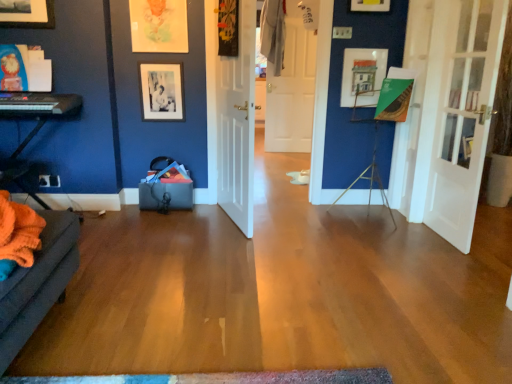
What are the coordinates of `white glass door at right, marked as the third door in a back-to-front arrangement` in the screenshot? It's located at (463, 115).

What do you see at coordinates (362, 76) in the screenshot?
I see `matte wooden picture frame at upper center, marked as the first picture frame in a right-to-left arrangement` at bounding box center [362, 76].

Measure the distance between point (148,81) and camera.

They are 3.19 meters apart.

I want to click on orange fabric couch at left, so pyautogui.click(x=34, y=127).

I want to click on matte paper picture frame at upper center, which is counted as the second picture frame, starting from the left, so click(x=159, y=26).

Can we say black matte picture frame at upper center, which is counted as the third picture frame, starting from the right, lies outside white matte door at center, the second door when ordered from right to left?

Yes, black matte picture frame at upper center, which is counted as the third picture frame, starting from the right, is not within white matte door at center, the second door when ordered from right to left.

Between black matte picture frame at upper center, which is counted as the third picture frame, starting from the right, and white matte door at center, acting as the 2th door starting from the left, which one appears on the right side from the viewer's perspective?

From the viewer's perspective, white matte door at center, acting as the 2th door starting from the left, appears more on the right side.

Would you consider black matte picture frame at upper center, marked as the first picture frame in a left-to-right arrangement, to be distant from white matte door at center, the second door when ordered from right to left?

Yes, black matte picture frame at upper center, marked as the first picture frame in a left-to-right arrangement, and white matte door at center, the second door when ordered from right to left, are located far from each other.

How many degrees apart are the facing directions of black matte picture frame at upper center, which is counted as the third picture frame, starting from the right, and white matte door at center, acting as the 2th door starting from the left?

The facing directions of black matte picture frame at upper center, which is counted as the third picture frame, starting from the right, and white matte door at center, acting as the 2th door starting from the left, are 8.02 degrees apart.

Relative to black matte picture frame at upper center, which is counted as the third picture frame, starting from the right, is black matte keyboard at left in front or behind?

black matte keyboard at left is in front of black matte picture frame at upper center, which is counted as the third picture frame, starting from the right.

Are black matte keyboard at left and black matte picture frame at upper center, which is counted as the third picture frame, starting from the right, making contact?

black matte keyboard at left is not next to black matte picture frame at upper center, which is counted as the third picture frame, starting from the right, and they're not touching.

The height and width of the screenshot is (384, 512). Find the location of `piano that appears in front of the black matte picture frame at upper center, marked as the first picture frame in a left-to-right arrangement`. piano that appears in front of the black matte picture frame at upper center, marked as the first picture frame in a left-to-right arrangement is located at coordinates (39, 104).

Considering the relative sizes of black matte keyboard at left and black matte picture frame at upper center, marked as the first picture frame in a left-to-right arrangement, in the image provided, is black matte keyboard at left thinner than black matte picture frame at upper center, marked as the first picture frame in a left-to-right arrangement,?

Incorrect, the width of black matte keyboard at left is not less than that of black matte picture frame at upper center, marked as the first picture frame in a left-to-right arrangement.

Is white glass door at right, the 1th door positioned from the front, shorter than matte paper picture frame at upper center, which appears as the 2th picture frame when viewed from the right?

No.

Looking at this image, which of these two, white glass door at right, which appears as the 1th door when viewed from the right, or matte paper picture frame at upper center, which appears as the 2th picture frame when viewed from the right, is bigger?

With larger size is white glass door at right, which appears as the 1th door when viewed from the right.

From a real-world perspective, does white glass door at right, which appears as the 1th door when viewed from the right, stand above matte paper picture frame at upper center, which is counted as the second picture frame, starting from the left?

Actually, white glass door at right, which appears as the 1th door when viewed from the right, is physically below matte paper picture frame at upper center, which is counted as the second picture frame, starting from the left, in the real world.

Does white glass door at right, which appears as the 1th door when viewed from the right, appear on the right side of matte paper picture frame at upper center, which appears as the 2th picture frame when viewed from the right?

Yes, white glass door at right, which appears as the 1th door when viewed from the right, is to the right of matte paper picture frame at upper center, which appears as the 2th picture frame when viewed from the right.

Based on their positions, is matte wooden picture frame at upper center, acting as the third picture frame starting from the left, located to the left or right of metallic tripod at center-right?

matte wooden picture frame at upper center, acting as the third picture frame starting from the left, is to the right of metallic tripod at center-right.

From the image's perspective, is matte wooden picture frame at upper center, acting as the third picture frame starting from the left, located above or below metallic tripod at center-right?

matte wooden picture frame at upper center, acting as the third picture frame starting from the left, is situated higher than metallic tripod at center-right in the image.

Considering the positions of point (373, 99) and point (347, 190), is point (373, 99) closer or farther from the camera than point (347, 190)?

Point (373, 99) is positioned closer to the camera compared to point (347, 190).

Based on the photo, which of these two, matte wooden picture frame at upper center, acting as the third picture frame starting from the left, or metallic tripod at center-right, stands shorter?

With less height is matte wooden picture frame at upper center, acting as the third picture frame starting from the left.

Is orange fabric couch at left inside or outside of matte paper picture frame at upper center, which appears as the 2th picture frame when viewed from the right?

orange fabric couch at left exists outside the volume of matte paper picture frame at upper center, which appears as the 2th picture frame when viewed from the right.

How distant is orange fabric couch at left from matte paper picture frame at upper center, which is counted as the second picture frame, starting from the left?

orange fabric couch at left and matte paper picture frame at upper center, which is counted as the second picture frame, starting from the left, are 31.76 inches apart from each other.

Where is `table on the left of matte paper picture frame at upper center, which appears as the 2th picture frame when viewed from the right`? This screenshot has height=384, width=512. table on the left of matte paper picture frame at upper center, which appears as the 2th picture frame when viewed from the right is located at coordinates (34, 127).

Can you confirm if orange fabric couch at left is thinner than matte paper picture frame at upper center, which is counted as the second picture frame, starting from the left?

Incorrect, the width of orange fabric couch at left is not less than that of matte paper picture frame at upper center, which is counted as the second picture frame, starting from the left.

Is matte paper picture frame at upper center, which is counted as the second picture frame, starting from the left, thinner than metallic tripod at center-right?

Correct, the width of matte paper picture frame at upper center, which is counted as the second picture frame, starting from the left, is less than that of metallic tripod at center-right.

From a real-world perspective, is matte paper picture frame at upper center, which is counted as the second picture frame, starting from the left, physically located above or below metallic tripod at center-right?

matte paper picture frame at upper center, which is counted as the second picture frame, starting from the left, is situated higher than metallic tripod at center-right in the real world.

Between matte paper picture frame at upper center, which is counted as the second picture frame, starting from the left, and metallic tripod at center-right, which one is positioned in front?

metallic tripod at center-right is in front.

Is matte paper picture frame at upper center, which appears as the 2th picture frame when viewed from the right, looking in the opposite direction of metallic tripod at center-right?

No, matte paper picture frame at upper center, which appears as the 2th picture frame when viewed from the right, is not facing away from metallic tripod at center-right.

Considering the sizes of objects white glass door at right, the 1th door positioned from the front, and white wooden door at center, the third door positioned from the right, in the image provided, who is bigger, white glass door at right, the 1th door positioned from the front, or white wooden door at center, the third door positioned from the right,?

With larger size is white wooden door at center, the third door positioned from the right.

Considering the positions of objects white glass door at right, which appears as the 1th door when viewed from the right, and white wooden door at center, positioned as the second door in back-to-front order, in the image provided, who is more to the left, white glass door at right, which appears as the 1th door when viewed from the right, or white wooden door at center, positioned as the second door in back-to-front order,?

Positioned to the left is white wooden door at center, positioned as the second door in back-to-front order.

From a real-world perspective, is white glass door at right, marked as the third door in a back-to-front arrangement, positioned above or below white wooden door at center, the first door when ordered from left to right?

white glass door at right, marked as the third door in a back-to-front arrangement, is below white wooden door at center, the first door when ordered from left to right.

Measure the distance from white glass door at right, which appears as the 1th door when viewed from the right, to white wooden door at center, the third door positioned from the right.

A distance of 4.40 feet exists between white glass door at right, which appears as the 1th door when viewed from the right, and white wooden door at center, the third door positioned from the right.

The height and width of the screenshot is (384, 512). Find the location of `the 3rd picture frame below when counting from the white matte door at center, acting as the 2th door starting from the left (from the image's perspective)`. the 3rd picture frame below when counting from the white matte door at center, acting as the 2th door starting from the left (from the image's perspective) is located at coordinates (161, 91).

There is a black matte keyboard at left. Where is `the 1st picture frame above it (from a real-world perspective)`? Image resolution: width=512 pixels, height=384 pixels. the 1st picture frame above it (from a real-world perspective) is located at coordinates (161, 91).

From the picture: From the image, which object appears to be farther from matte paper picture frame at upper center, which is counted as the second picture frame, starting from the left, multicolored woven mat at lower center or white glass door at right, which is the 3th door from left to right?

multicolored woven mat at lower center is positioned further to the anchor matte paper picture frame at upper center, which is counted as the second picture frame, starting from the left.

Looking at this image, from the image, which object appears to be nearer to matte paper picture frame at upper center, which appears as the 2th picture frame when viewed from the right, matte wooden picture frame at upper center, marked as the first picture frame in a right-to-left arrangement, or white matte door at center, which is the third door in front-to-back order?

matte wooden picture frame at upper center, marked as the first picture frame in a right-to-left arrangement.

Which object lies nearer to the anchor point white matte door at center, which appears as the 1th door when viewed from the back, white wooden door at center, positioned as the second door in back-to-front order, or black matte keyboard at left?

white wooden door at center, positioned as the second door in back-to-front order.

From the image, which object appears to be nearer to white glass door at right, which appears as the 1th door when viewed from the right, metallic tripod at center-right or black matte keyboard at left?

Among the two, metallic tripod at center-right is located nearer to white glass door at right, which appears as the 1th door when viewed from the right.

Looking at the image, which one is located further to matte paper picture frame at upper center, which is counted as the second picture frame, starting from the left, black matte picture frame at upper center, marked as the first picture frame in a left-to-right arrangement, or black matte keyboard at left?

black matte keyboard at left.

When comparing their distances from orange fabric couch at left, does matte paper picture frame at upper center, which appears as the 2th picture frame when viewed from the right, or white wooden door at center, which ranks as the second door in front-to-back order, seem closer?

matte paper picture frame at upper center, which appears as the 2th picture frame when viewed from the right, lies closer to orange fabric couch at left than the other object.

Which object lies nearer to the anchor point metallic tripod at center-right, white matte door at center, which appears as the 1th door when viewed from the back, or orange fabric couch at left?

Among the two, orange fabric couch at left is located nearer to metallic tripod at center-right.

From the picture: Estimate the real-world distances between objects in this image. Which object is closer to matte paper picture frame at upper center, which is counted as the second picture frame, starting from the left, metallic tripod at center-right or black matte keyboard at left?

black matte keyboard at left.

Find the location of `tripod between orange fabric couch at left and white glass door at right, marked as the third door in a back-to-front arrangement, in the horizontal direction`. tripod between orange fabric couch at left and white glass door at right, marked as the third door in a back-to-front arrangement, in the horizontal direction is located at coordinates (370, 171).

Where is `tripod between black matte keyboard at left and white matte door at center, the second door when ordered from right to left, in the front-back direction`? The image size is (512, 384). tripod between black matte keyboard at left and white matte door at center, the second door when ordered from right to left, in the front-back direction is located at coordinates (370, 171).

The image size is (512, 384). Identify the location of piano between orange fabric couch at left and black matte picture frame at upper center, which is counted as the third picture frame, starting from the right, in the horizontal direction. (39, 104).

Where is `tripod between white wooden door at center, positioned as the second door in back-to-front order, and matte wooden picture frame at upper center, acting as the third picture frame starting from the left`? The image size is (512, 384). tripod between white wooden door at center, positioned as the second door in back-to-front order, and matte wooden picture frame at upper center, acting as the third picture frame starting from the left is located at coordinates (370, 171).